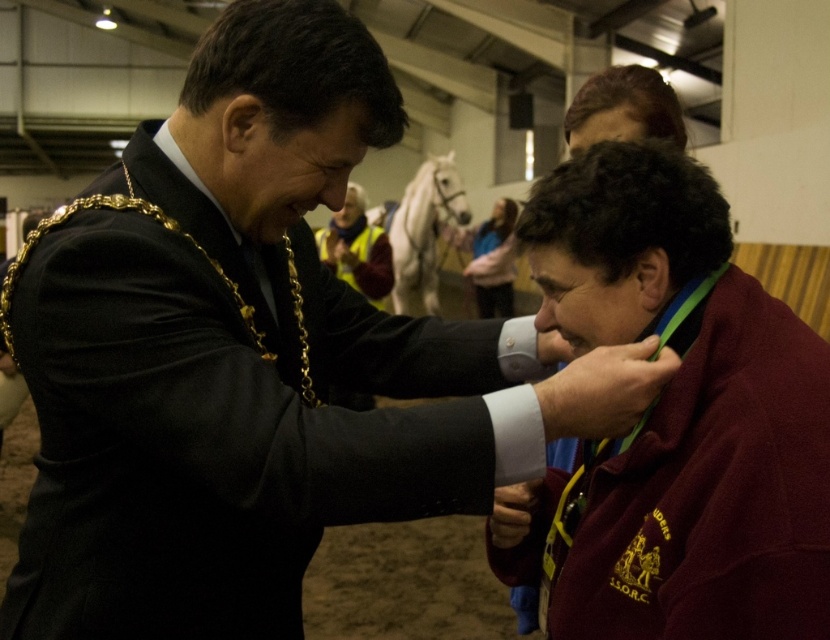
Question: Does maroon jersey at center have a larger size compared to maroon fleece at center?

Choices:
 (A) no
 (B) yes

Answer: (B)

Question: From the image, what is the correct spatial relationship of maroon jersey at center in relation to maroon fleece at center?

Choices:
 (A) right
 (B) left

Answer: (B)

Question: Does maroon jersey at center appear under maroon fleece at center?

Choices:
 (A) yes
 (B) no

Answer: (B)